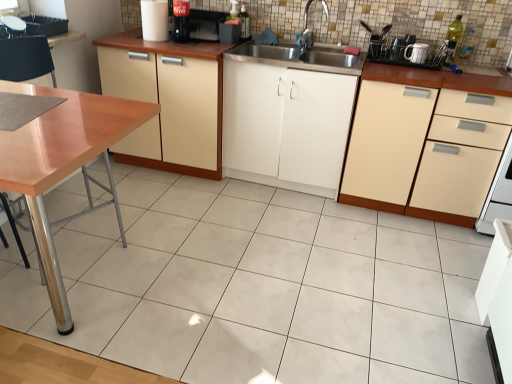
At what (x,y) coordinates should I click in order to perform the action: click on vacant space in wooden table at left (from a real-world perspective). Please return your answer as a coordinate pair (x, y). Looking at the image, I should click on (58, 319).